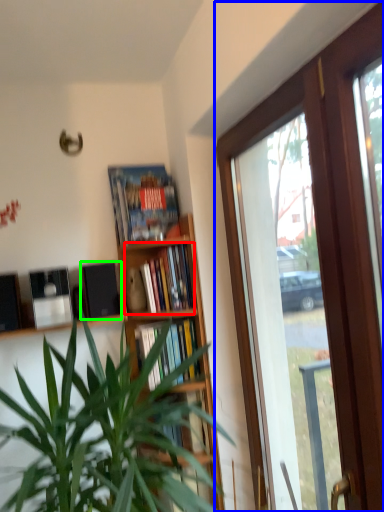
Question: Estimate the real-world distances between objects in this image. Which object is farther from book (highlighted by a red box), window (highlighted by a blue box) or loudspeaker (highlighted by a green box)?

Choices:
 (A) window
 (B) loudspeaker

Answer: (A)